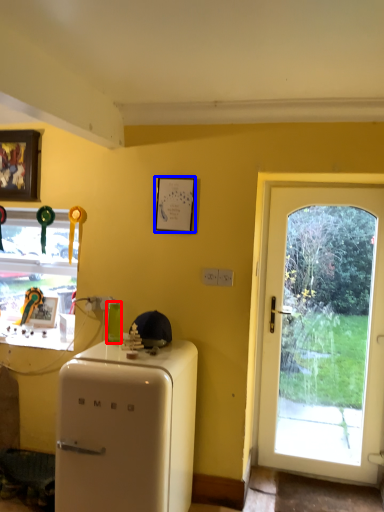
Question: Which object appears farthest to the camera in this image, bottle (highlighted by a red box) or picture frame (highlighted by a blue box)?

Choices:
 (A) bottle
 (B) picture frame

Answer: (B)